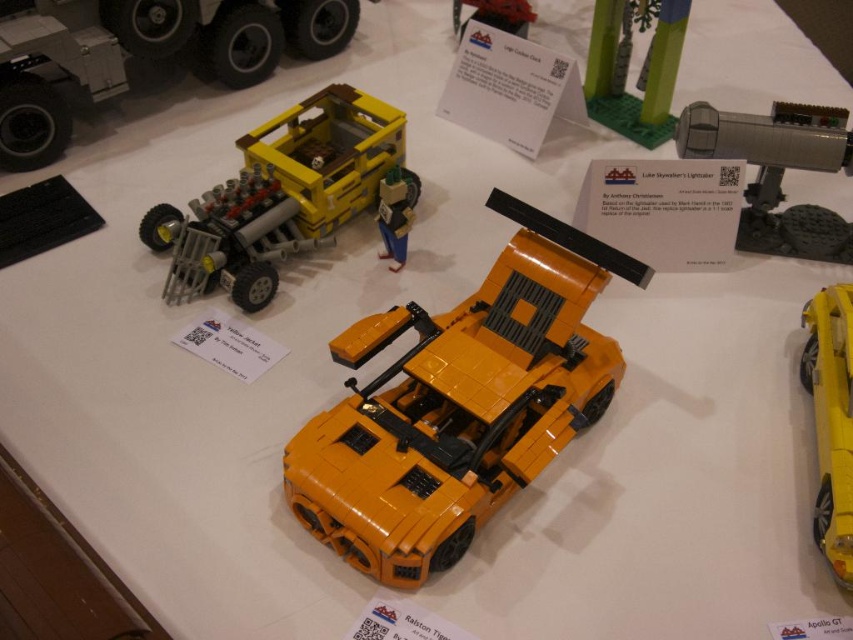
Question: Can you confirm if matte yellow truck at upper center is positioned to the right of shiny yellow car at center?

Choices:
 (A) yes
 (B) no

Answer: (B)

Question: Which is nearer to the metallic gray gun at upper right?

Choices:
 (A) green matte tree at upper center
 (B) shiny yellow car at center
 (C) matte yellow truck at upper center
 (D) yellow matte truck at upper left

Answer: (B)

Question: Among these points, which one is nearest to the camera?

Choices:
 (A) (44, 104)
 (B) (560, 237)

Answer: (B)

Question: Observing the image, what is the correct spatial positioning of metallic gray gun at upper right in reference to matte black car at upper center?

Choices:
 (A) below
 (B) above

Answer: (A)

Question: Which point is closer to the camera taking this photo?

Choices:
 (A) (622, 134)
 (B) (814, 365)
 (C) (804, 257)

Answer: (B)

Question: Can you confirm if green matte tree at upper center is smaller than matte black car at upper center?

Choices:
 (A) no
 (B) yes

Answer: (A)